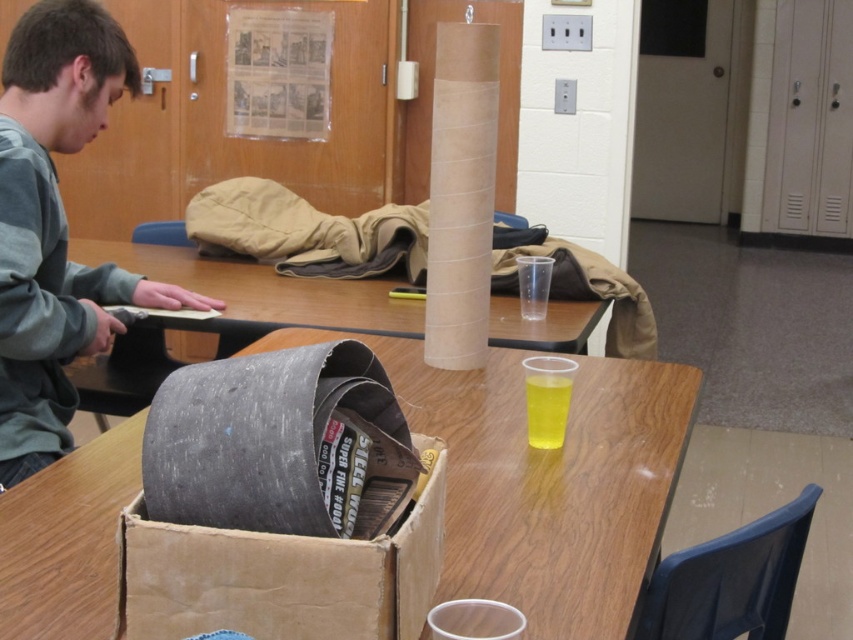
Question: Can you confirm if brown cardboard box at center is positioned to the right of wooden table at center?

Choices:
 (A) no
 (B) yes

Answer: (B)

Question: Among these objects, which one is farthest from the camera?

Choices:
 (A) wooden table at center
 (B) brown cardboard box at center
 (C) cardboard box at center
 (D) gray fabric shirt at left

Answer: (A)

Question: Which point is farther to the camera?

Choices:
 (A) (164, 552)
 (B) (509, 484)

Answer: (B)

Question: Can you confirm if cardboard box at center is bigger than gray fabric shirt at left?

Choices:
 (A) yes
 (B) no

Answer: (A)

Question: Can you confirm if gray fabric shirt at left is bigger than brown cardboard box at center?

Choices:
 (A) yes
 (B) no

Answer: (A)

Question: Which point is closer to the camera taking this photo?

Choices:
 (A) (16, 310)
 (B) (415, 451)
 (C) (248, 280)
 (D) (592, 488)

Answer: (B)